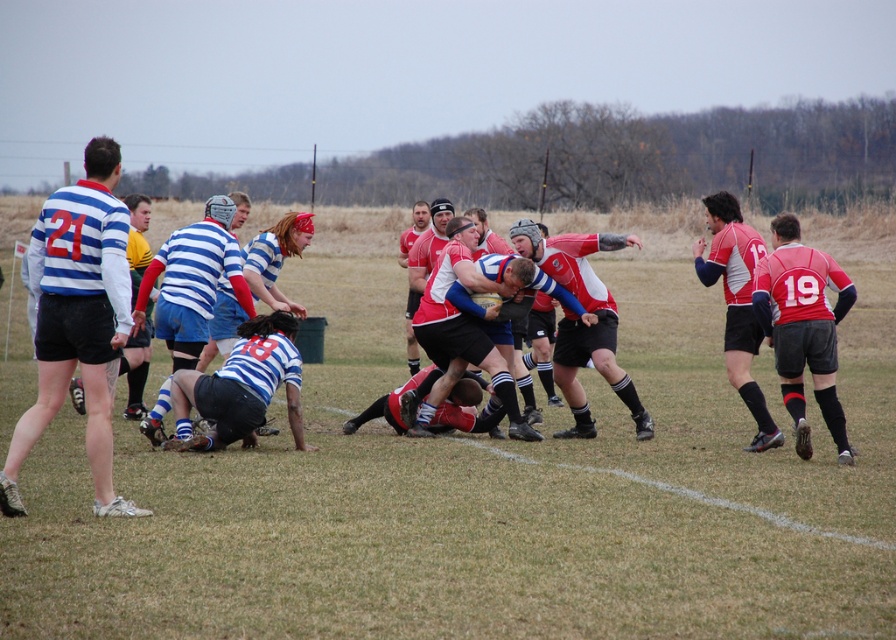
Question: Which of the following is the closest to the observer?

Choices:
 (A) matte red rugby jersey at right
 (B) striped jersey shorts at left

Answer: (B)

Question: Considering the relative positions of striped jersey shorts at left and matte red rugby jersey at right in the image provided, where is striped jersey shorts at left located with respect to matte red rugby jersey at right?

Choices:
 (A) left
 (B) right

Answer: (A)

Question: Is striped jersey shorts at left thinner than matte red rugby jersey at right?

Choices:
 (A) no
 (B) yes

Answer: (A)

Question: Does striped jersey shorts at left appear on the left side of matte red rugby jersey at right?

Choices:
 (A) no
 (B) yes

Answer: (B)